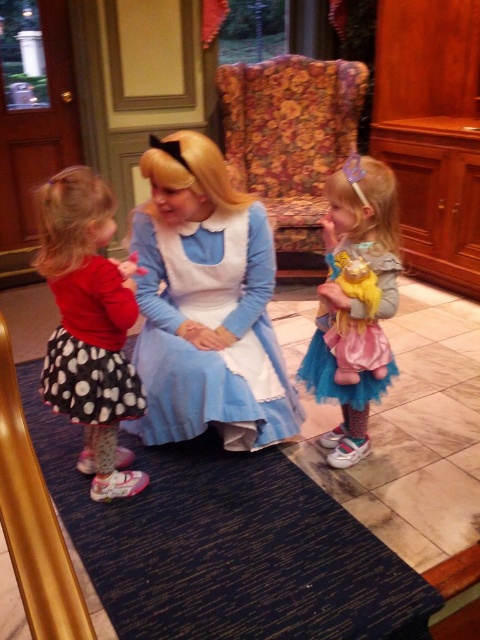
Question: Which is farther from the black dotted fabric dress at left?

Choices:
 (A) polka dot skirt at left
 (B) blue satin dress at center
 (C) pastel pink tulle skirt at center

Answer: (C)

Question: Which object appears closest to the camera in this image?

Choices:
 (A) polka dot skirt at left
 (B) pastel pink tulle skirt at center
 (C) blue satin dress at center

Answer: (A)

Question: Can you confirm if blue satin dress at center is smaller than pastel pink tulle skirt at center?

Choices:
 (A) no
 (B) yes

Answer: (A)

Question: Is blue satin dress at center thinner than black dotted fabric dress at left?

Choices:
 (A) yes
 (B) no

Answer: (B)

Question: Estimate the real-world distances between objects in this image. Which object is farther from the polka dot skirt at left?

Choices:
 (A) blue satin dress at center
 (B) black dotted fabric dress at left
 (C) pastel pink tulle skirt at center

Answer: (C)

Question: Does polka dot skirt at left appear on the left side of black dotted fabric dress at left?

Choices:
 (A) no
 (B) yes

Answer: (B)